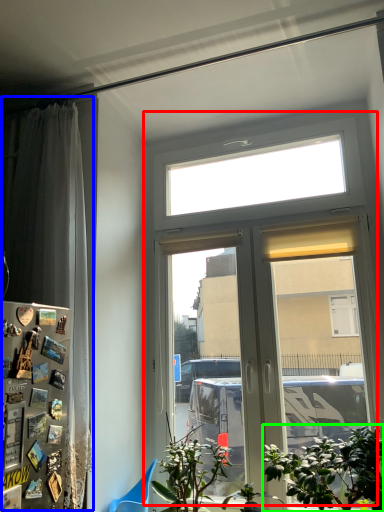
Question: Considering the real-world distances, which object is closest to window (highlighted by a red box)? curtain (highlighted by a blue box) or houseplant (highlighted by a green box).

Choices:
 (A) curtain
 (B) houseplant

Answer: (B)